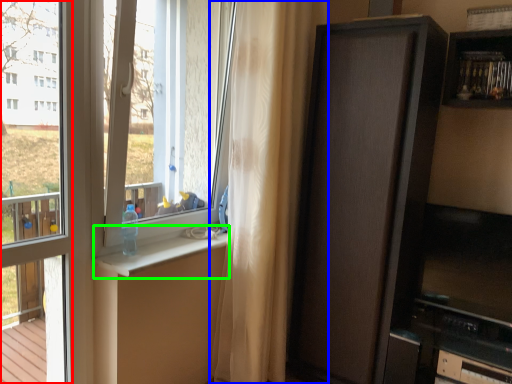
Question: Estimate the real-world distances between objects in this image. Which object is farther from window frame (highlighted by a red box), curtain (highlighted by a blue box) or window sill (highlighted by a green box)?

Choices:
 (A) curtain
 (B) window sill

Answer: (A)